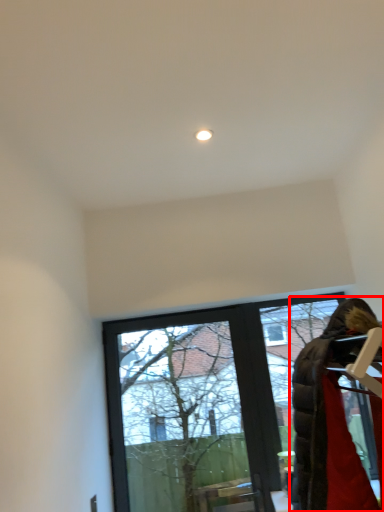
Question: Observing the image, what is the correct spatial positioning of woman (annotated by the red box) in reference to window?

Choices:
 (A) left
 (B) right

Answer: (B)